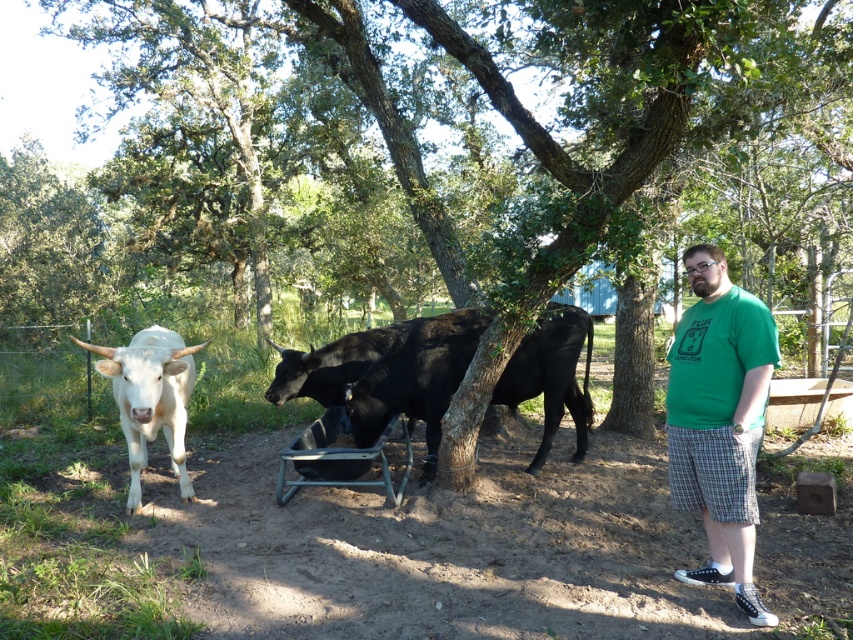
Does black glossy bull at center have a lesser width compared to metallic gray cart at center?

No, black glossy bull at center is not thinner than metallic gray cart at center.

Can you confirm if black glossy bull at center is smaller than metallic gray cart at center?

Actually, black glossy bull at center might be larger than metallic gray cart at center.

Is point (556, 410) behind point (379, 440)?

Yes, point (556, 410) is behind point (379, 440).

Image resolution: width=853 pixels, height=640 pixels. Find the location of `black glossy bull at center`. black glossy bull at center is located at coordinates (389, 372).

Does green t-shirt at right appear on the right side of black glossy bull at center?

Indeed, green t-shirt at right is positioned on the right side of black glossy bull at center.

Is point (711, 381) closer to viewer compared to point (552, 355)?

Yes.

Which is in front, point (759, 321) or point (314, 376)?

Point (759, 321)

The image size is (853, 640). Identify the location of green t-shirt at right. tap(718, 420).

Between point (401, 17) and point (346, 419), which one is positioned behind?

The point (401, 17) is behind.

Which of these two, green leafy tree at center or metallic gray cart at center, stands shorter?

Standing shorter between the two is metallic gray cart at center.

What do you see at coordinates (486, 141) in the screenshot? I see `green leafy tree at center` at bounding box center [486, 141].

Image resolution: width=853 pixels, height=640 pixels. Find the location of `green leafy tree at center`. green leafy tree at center is located at coordinates (486, 141).